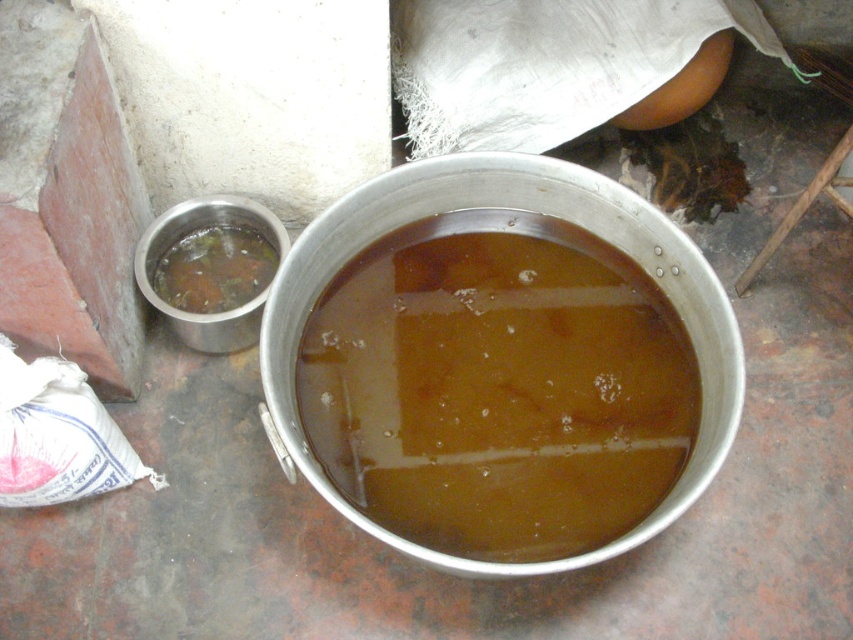
Question: From the image, what is the correct spatial relationship of brown liquid at center in relation to brown liquid at lower left?

Choices:
 (A) below
 (B) above

Answer: (A)

Question: Does brown liquid at center have a smaller size compared to brown liquid at lower left?

Choices:
 (A) no
 (B) yes

Answer: (A)

Question: Which point is farther from the camera taking this photo?

Choices:
 (A) (560, 280)
 (B) (207, 269)

Answer: (B)

Question: Can you confirm if brown liquid at center is positioned below brown liquid at lower left?

Choices:
 (A) yes
 (B) no

Answer: (A)